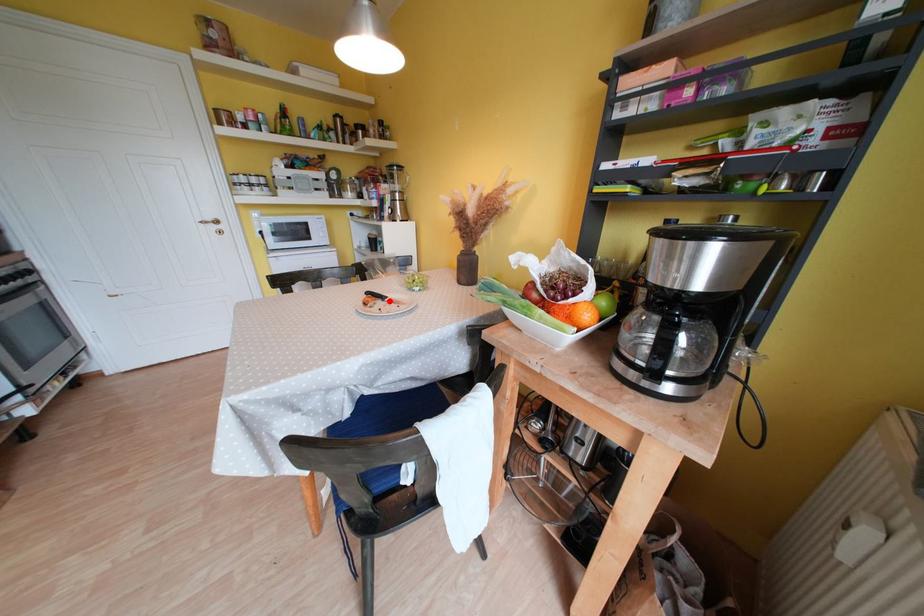
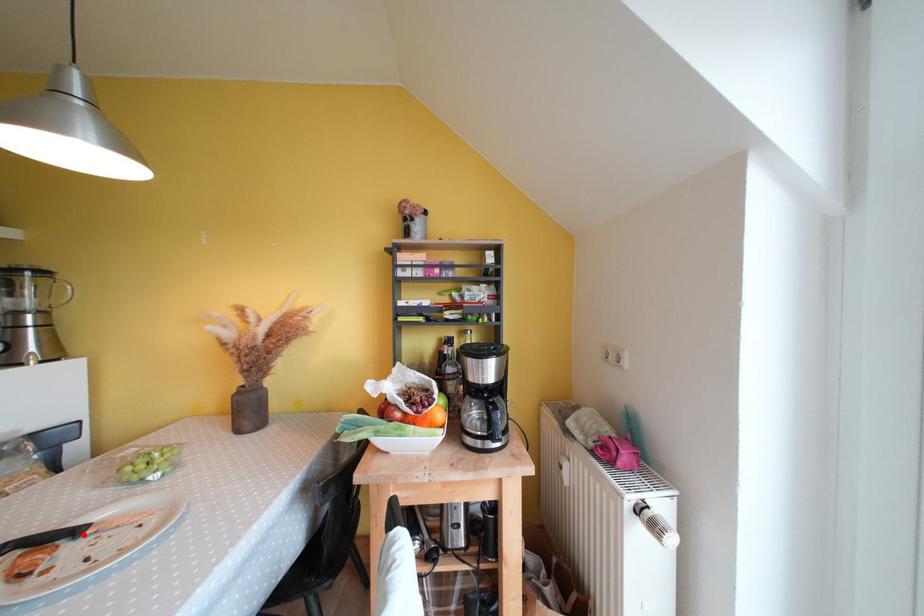
I am providing you with two images of the same scene from different viewpoints. A red point is marked on the first image and another point is marked on the second image. Is the red point in image1 aligned with the point shown in image2?

Yes